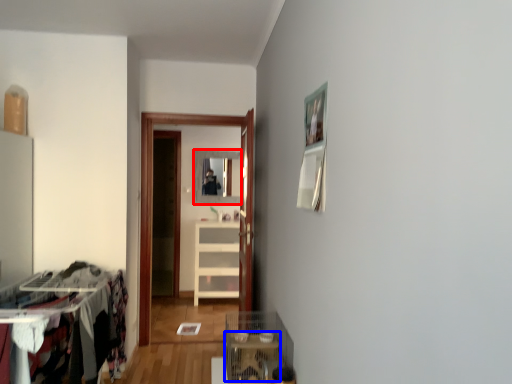
Question: Which object is closer to the camera taking this photo, mirror (highlighted by a red box) or table (highlighted by a blue box)?

Choices:
 (A) mirror
 (B) table

Answer: (B)